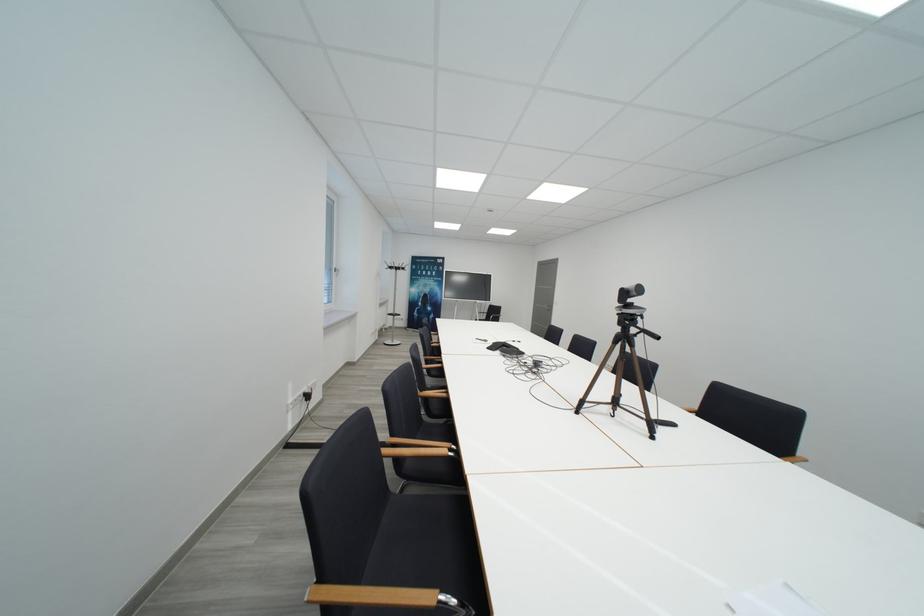
Locate an element on the screen. The height and width of the screenshot is (616, 924). white window handle is located at coordinates (332, 270).